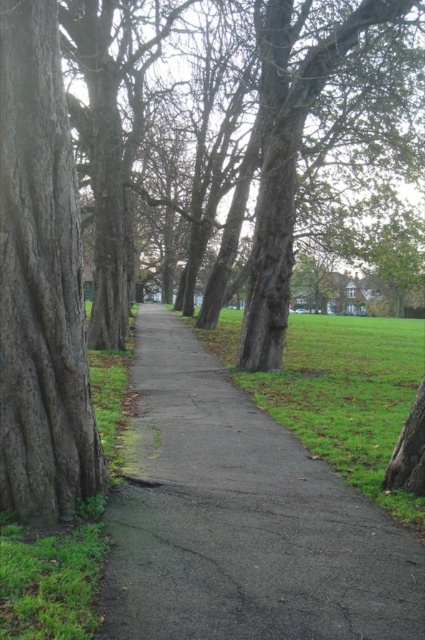
You are a gardener planning to mow the green grass at center. To ensure the lawnmower doesn t hit the dark brown textured bark at left, which direction should you avoid mowing towards?

The dark brown textured bark at left has a lesser width compared to green grass at center. Therefore, you should avoid mowing towards the direction of the dark brown textured bark at left to prevent hitting it.

You are standing at the entrance of the park and see the gray asphalt path at center and the dark brown textured bark at left. Which object is closer to you?

The gray asphalt path at center is closer to you because it is in front of the dark brown textured bark at left.